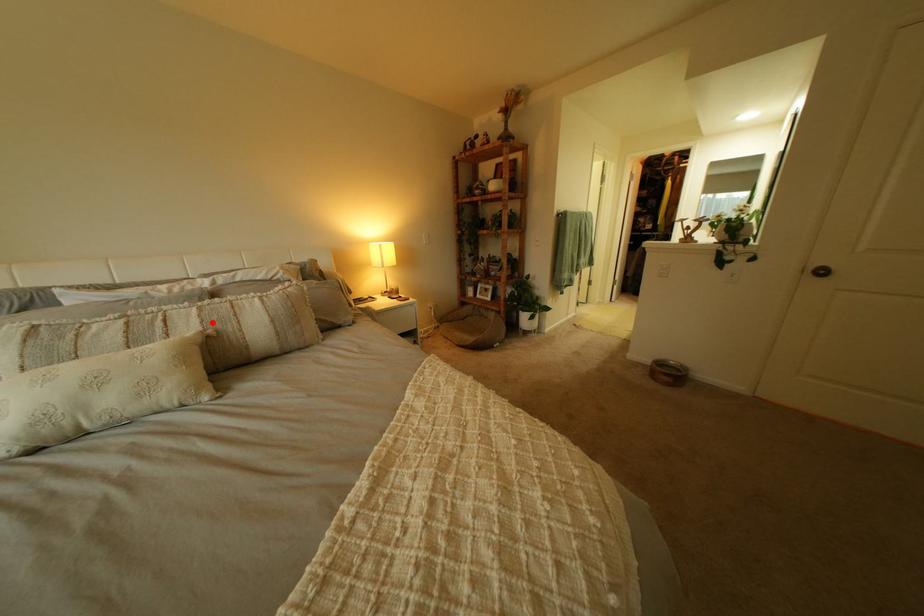
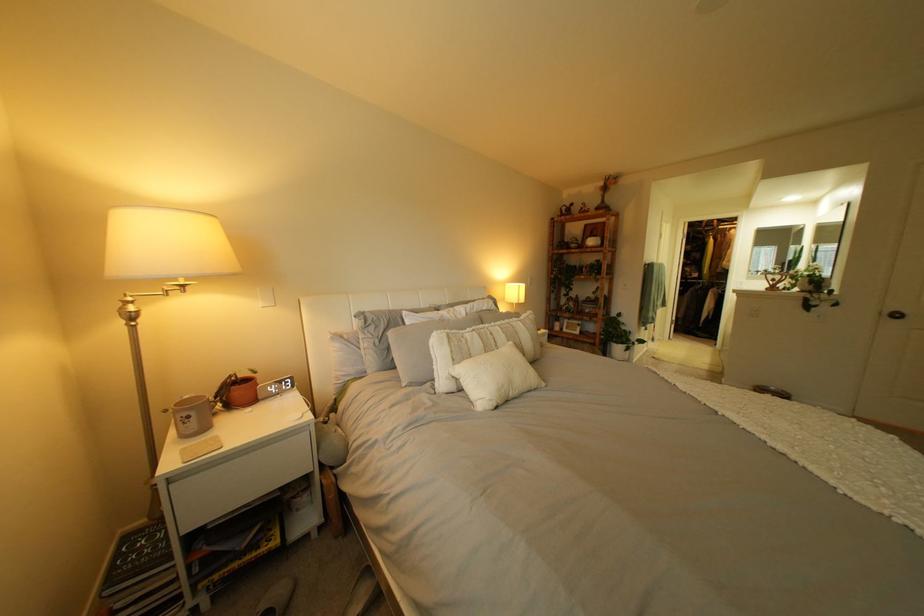
The point at the highlighted location is marked in the first image. Where is the corresponding point in the second image?

(518, 337)